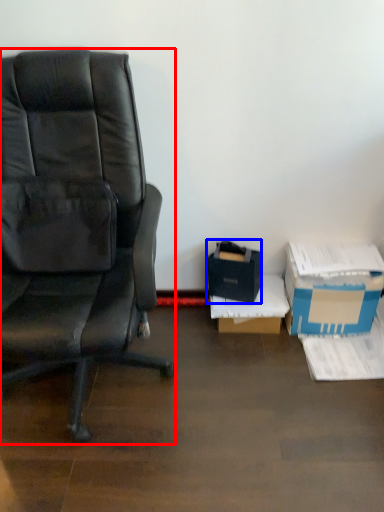
Question: Which object is closer to the camera taking this photo, chair (highlighted by a red box) or box (highlighted by a blue box)?

Choices:
 (A) chair
 (B) box

Answer: (A)